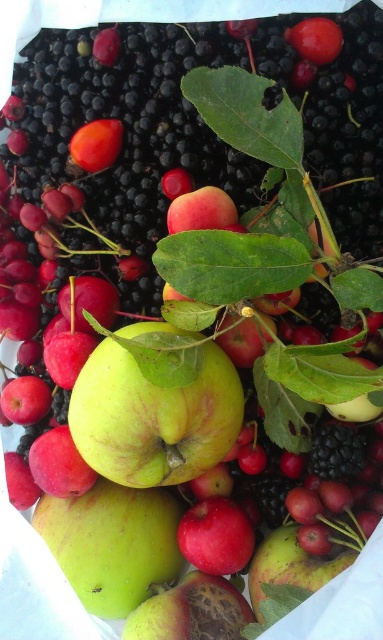
Which of these two, green matte apple at center or smooth orange fruit at upper left, stands shorter?

Standing shorter between the two is smooth orange fruit at upper left.

Who is higher up, green matte apple at center or smooth orange fruit at upper left?

smooth orange fruit at upper left

Find the location of a particular element. Image resolution: width=383 pixels, height=640 pixels. green matte apple at center is located at coordinates point(152,419).